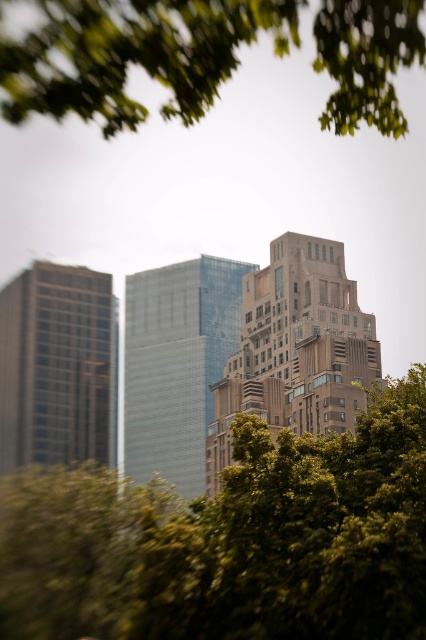
You are a city planner assessing a new construction project. You need to determine if the green leafy tree at upper center will block sunlight to the brown stone building at center during winter. Based on their heights, can the tree cast a shadow on the building?

The green leafy tree at upper center is not as tall as the brown stone building at center, so it cannot cast a shadow on the building during winter.

You are a photographer planning to capture a wide shot of the cityscape. You notice the green leafy tree at center and the glassy reflective skyscraper at center. Based on their sizes, which object would appear more prominent in the photo?

The glassy reflective skyscraper at center would appear more prominent in the photo since it is larger than the green leafy tree at center according to the description.

You are standing in the city park and want to take a photo of the brown stone building at center without the green leafy tree at upper center blocking it. How should you adjust your position?

Move backward to create distance between yourself and the green leafy tree at upper center so that the brown stone building at center becomes more visible behind it.